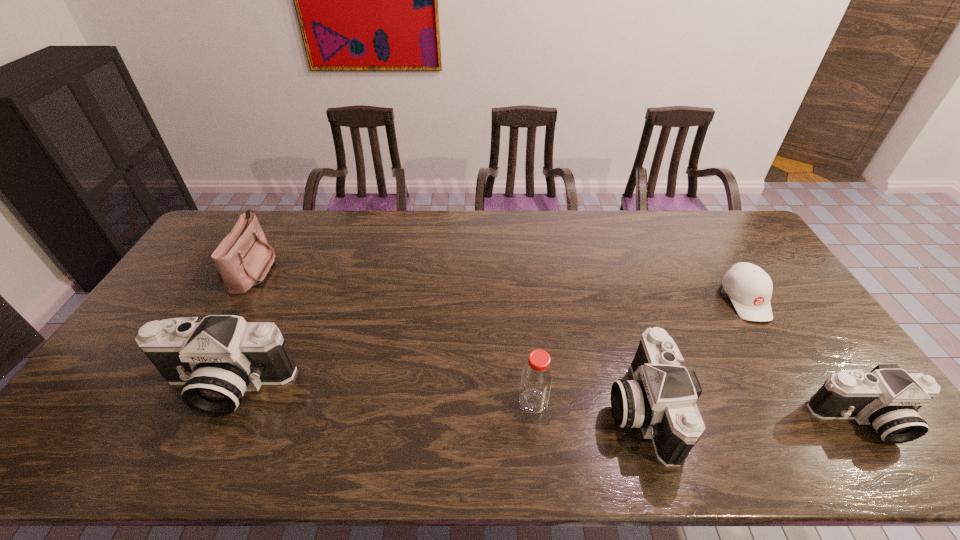
Identify the location of vacant position for inserting another camera evenly. This screenshot has height=540, width=960. (429, 396).